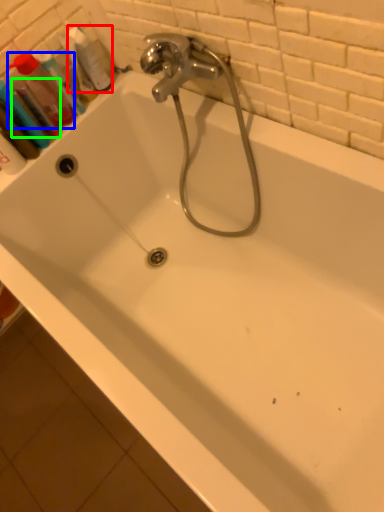
Question: Estimate the real-world distances between objects in this image. Which object is farther from cleaning product (highlighted by a red box), mouthwash (highlighted by a blue box) or mouthwash (highlighted by a green box)?

Choices:
 (A) mouthwash
 (B) mouthwash

Answer: (B)